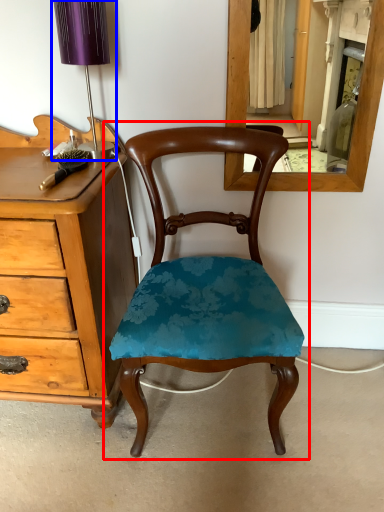
Question: Which of the following is the farthest to the observer, chair (highlighted by a red box) or table lamp (highlighted by a blue box)?

Choices:
 (A) chair
 (B) table lamp

Answer: (B)